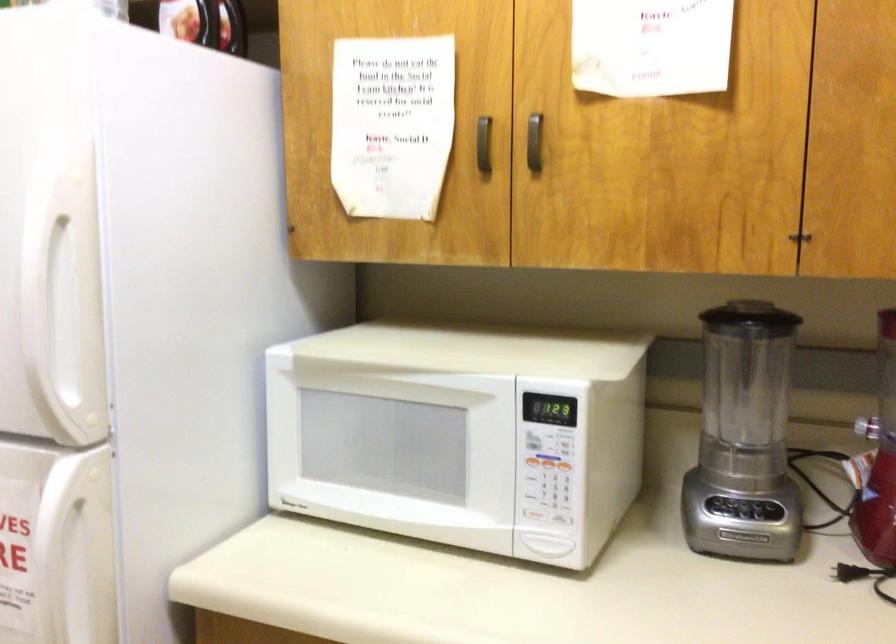
Where would you push the microwave door button? Please return your answer as a coordinate pair (x, y).

(547, 462)